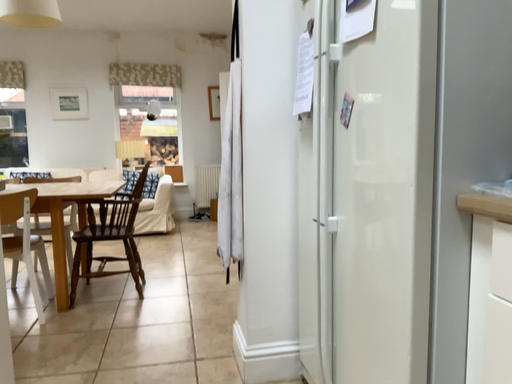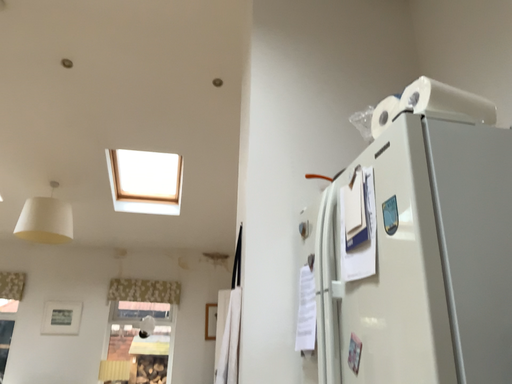
Question: Which way did the camera rotate in the video?

Choices:
 (A) rotated downward
 (B) rotated upward

Answer: (B)